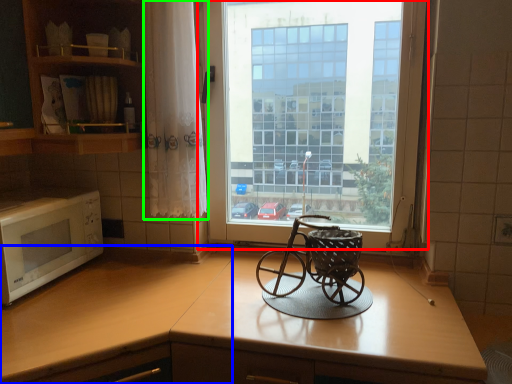
Question: Considering the real-world distances, which object is farthest from window (highlighted by a red box)? counter top (highlighted by a blue box) or curtain (highlighted by a green box)?

Choices:
 (A) counter top
 (B) curtain

Answer: (A)